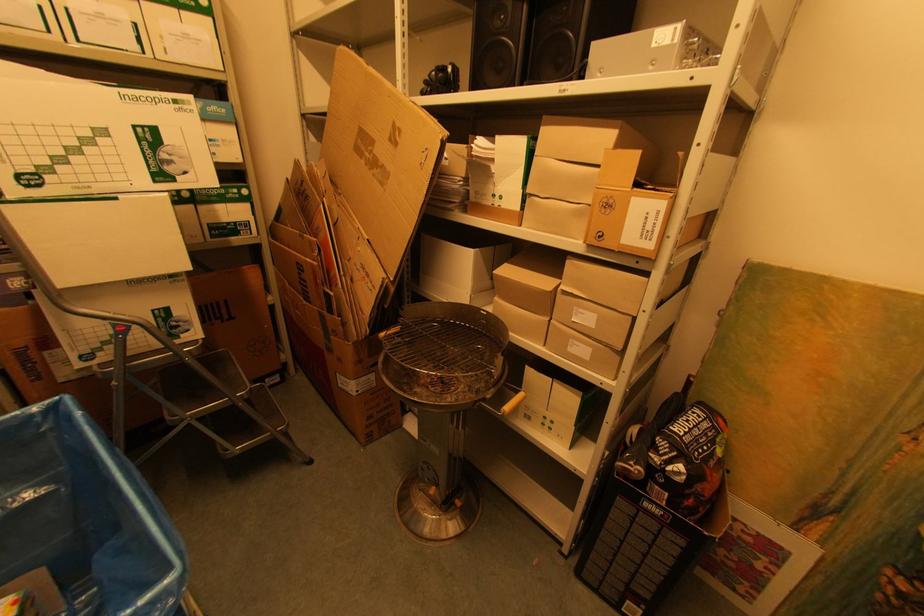
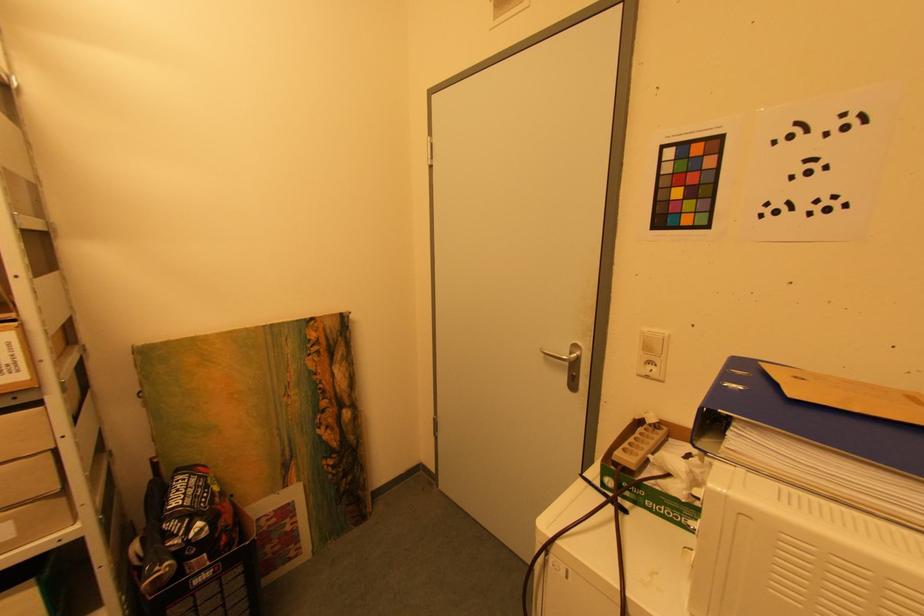
Question: The camera is either moving clockwise (left) or counter-clockwise (right) around the object. The first image is from the beginning of the video and the second image is from the end. Is the camera moving left or right when shooting the video?

Choices:
 (A) Left
 (B) Right

Answer: (A)